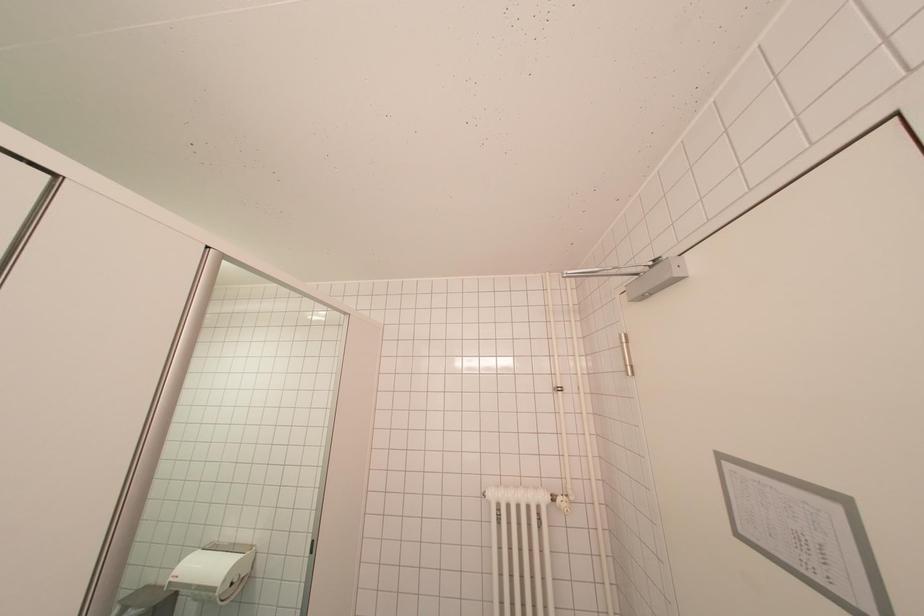
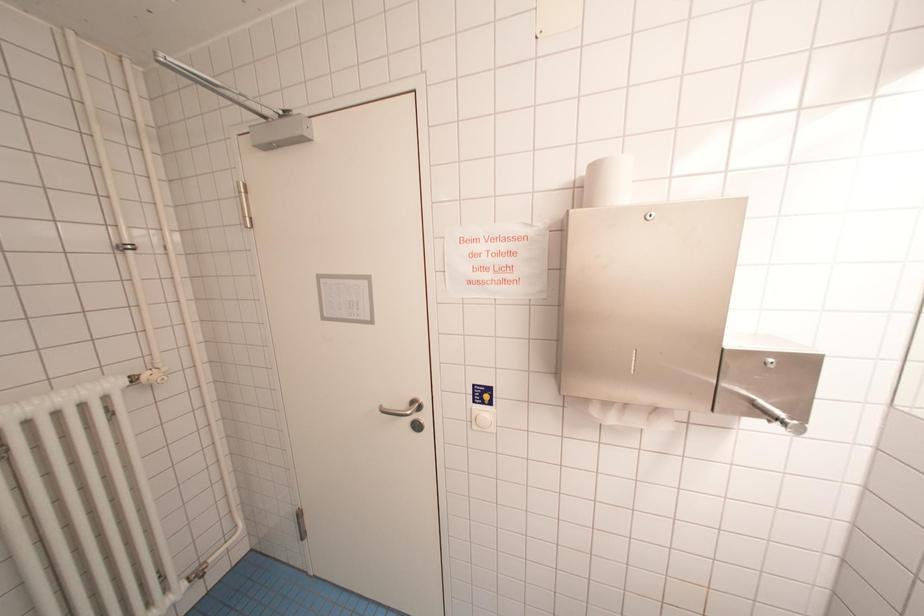
Question: The camera is either moving clockwise (left) or counter-clockwise (right) around the object. The first image is from the beginning of the video and the second image is from the end. Is the camera moving left or right when shooting the video?

Choices:
 (A) Left
 (B) Right

Answer: (A)